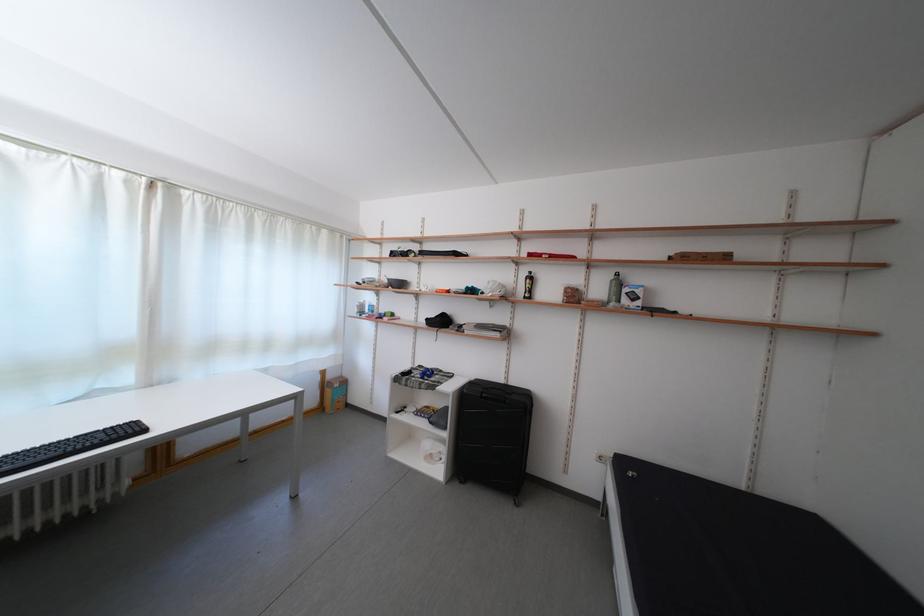
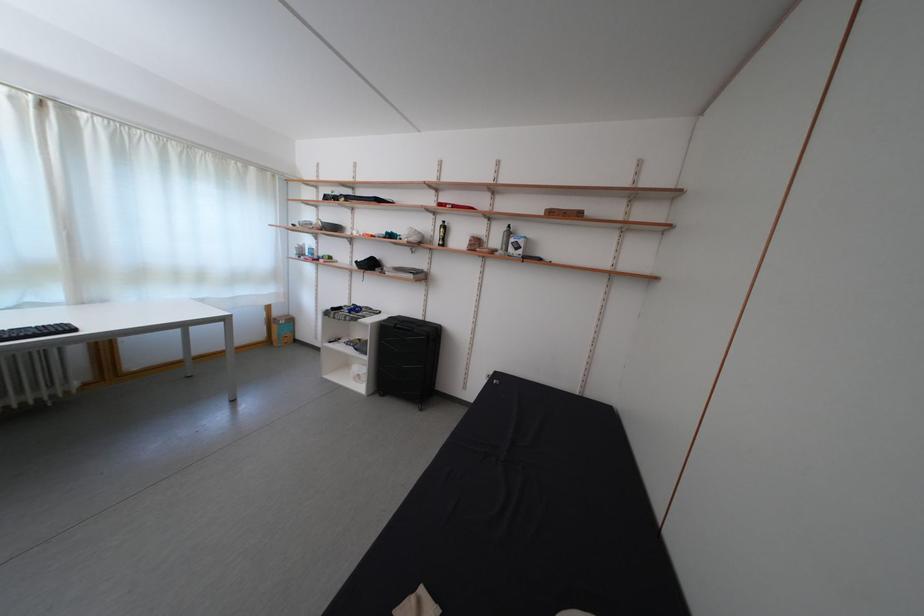
The point at (x=380, y=277) is marked in the first image. Where is the corresponding point in the second image?

(319, 221)